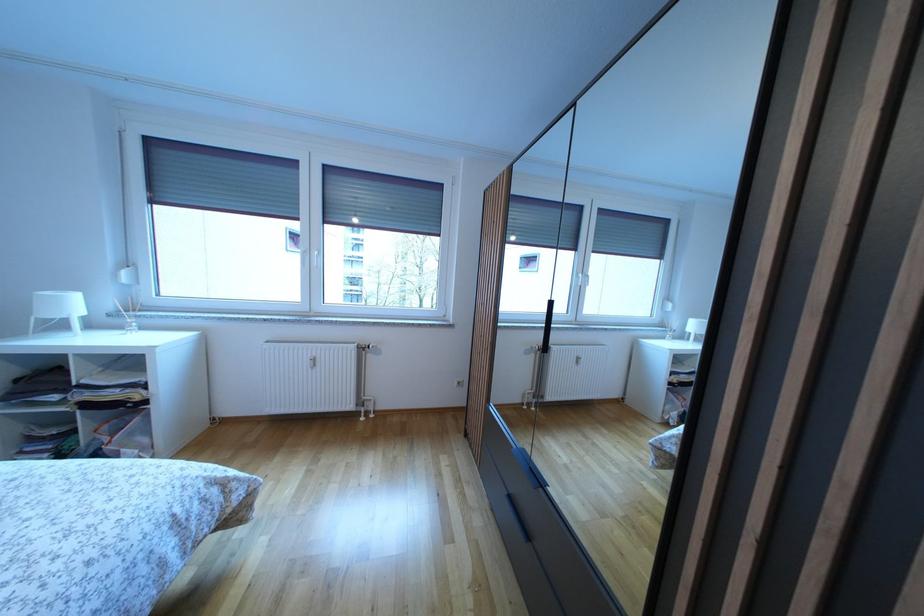
This screenshot has width=924, height=616. What are the coordinates of `white lamp` in the screenshot? It's located at (57, 308).